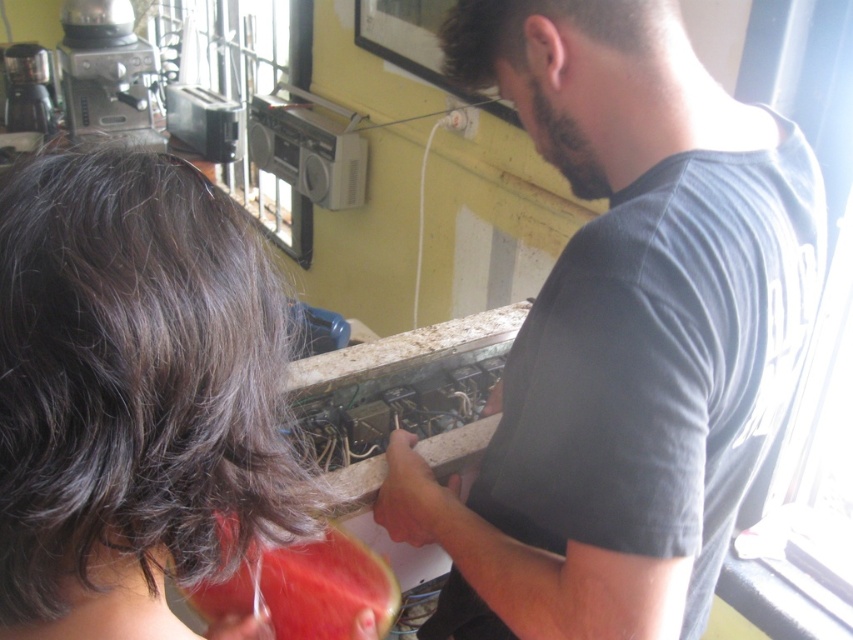
Question: Considering the real-world distances, which object is closest to the gray matte shirt at center?

Choices:
 (A) dark brown hair at upper left
 (B) red matte watermelon at lower left

Answer: (B)

Question: Is gray matte shirt at center smaller than dark brown hair at upper left?

Choices:
 (A) yes
 (B) no

Answer: (B)

Question: Which object is farther from the camera taking this photo?

Choices:
 (A) red matte watermelon at lower left
 (B) dark brown hair at upper left
 (C) gray matte shirt at center

Answer: (C)

Question: Based on their relative distances, which object is farther from the gray matte shirt at center?

Choices:
 (A) dark brown hair at upper left
 (B) red matte watermelon at lower left

Answer: (A)

Question: Is the position of gray matte shirt at center less distant than that of dark brown hair at upper left?

Choices:
 (A) yes
 (B) no

Answer: (B)

Question: Is gray matte shirt at center to the right of red matte watermelon at lower left from the viewer's perspective?

Choices:
 (A) yes
 (B) no

Answer: (A)